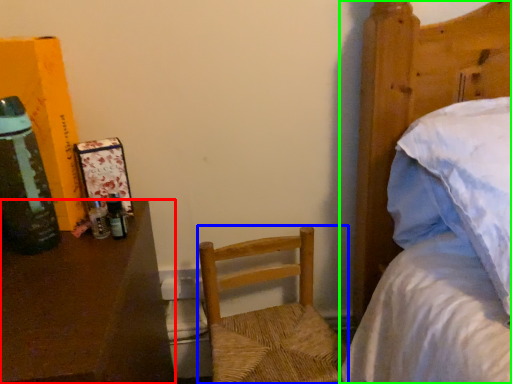
Question: Which object is positioned farthest from desk (highlighted by a red box)? Select from chair (highlighted by a blue box) and bed (highlighted by a green box).

Choices:
 (A) chair
 (B) bed

Answer: (B)